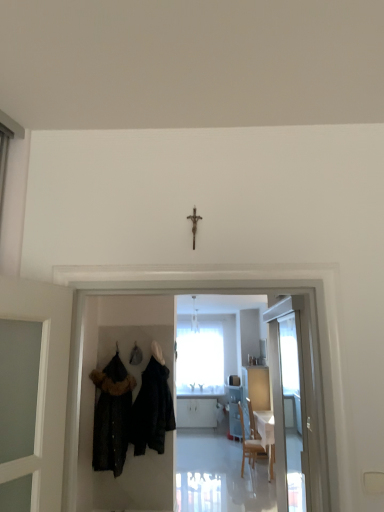
The width and height of the screenshot is (384, 512). I want to click on metallic crucifix at center, so click(x=194, y=223).

How much space does velvet black coat at left, which is counted as the 1th fancy dress, starting from the left, occupy horizontally?

The width of velvet black coat at left, which is counted as the 1th fancy dress, starting from the left, is 12.02 inches.

Where is `white glossy door at right`? white glossy door at right is located at coordinates (290, 401).

Between metallic crucifix at center and velvet black coat at center, which is counted as the first fancy dress, starting from the right, which one appears on the right side from the viewer's perspective?

From the viewer's perspective, metallic crucifix at center appears more on the right side.

From a real-world perspective, is metallic crucifix at center on velvet black coat at center, which is counted as the second fancy dress, starting from the left?

Yes, from a real-world perspective, metallic crucifix at center is on top of velvet black coat at center, which is counted as the second fancy dress, starting from the left.

Considering the sizes of metallic crucifix at center and velvet black coat at center, which is counted as the first fancy dress, starting from the right, in the image, is metallic crucifix at center bigger or smaller than velvet black coat at center, which is counted as the first fancy dress, starting from the right,?

In the image, metallic crucifix at center appears to be smaller than velvet black coat at center, which is counted as the first fancy dress, starting from the right.

Does point (193, 217) lie in front of point (146, 410)?

That is True.

Looking at this image, from a real-world perspective, is white glossy door at right physically below velvet black coat at center, which is counted as the first fancy dress, starting from the right?

No, from a real-world perspective, white glossy door at right is not beneath velvet black coat at center, which is counted as the first fancy dress, starting from the right.

Choose the correct answer: Is white glossy door at right inside velvet black coat at center, which is counted as the first fancy dress, starting from the right, or outside it?

white glossy door at right is spatially situated outside velvet black coat at center, which is counted as the first fancy dress, starting from the right.

Looking at this image, who is smaller, white glossy door at right or velvet black coat at center, which is counted as the second fancy dress, starting from the left?

white glossy door at right is smaller.

Is white glossy door at right shorter than velvet black coat at center, which is counted as the second fancy dress, starting from the left?

No, white glossy door at right is not shorter than velvet black coat at center, which is counted as the second fancy dress, starting from the left.

Is velvet black coat at left, arranged as the second fancy dress when viewed from the right, located within metallic crucifix at center?

No, velvet black coat at left, arranged as the second fancy dress when viewed from the right, is not a part of metallic crucifix at center.

From the image's perspective, which one is positioned higher, metallic crucifix at center or velvet black coat at left, which is counted as the 1th fancy dress, starting from the left?

metallic crucifix at center.

Is metallic crucifix at center far from velvet black coat at left, which is counted as the 1th fancy dress, starting from the left?

Yes, metallic crucifix at center and velvet black coat at left, which is counted as the 1th fancy dress, starting from the left, are located far from each other.

From a real-world perspective, is metallic crucifix at center below velvet black coat at left, which is counted as the 1th fancy dress, starting from the left?

Incorrect, from a real-world perspective, metallic crucifix at center is higher than velvet black coat at left, which is counted as the 1th fancy dress, starting from the left.

Measure the distance from white glossy door at right to velvet black coat at left, arranged as the second fancy dress when viewed from the right.

white glossy door at right and velvet black coat at left, arranged as the second fancy dress when viewed from the right, are 1.40 meters apart from each other.

From the image's perspective, which one is positioned lower, white glossy door at right or velvet black coat at left, which is counted as the 1th fancy dress, starting from the left?

velvet black coat at left, which is counted as the 1th fancy dress, starting from the left, is shown below in the image.

Considering the points (298, 425) and (109, 383), which point is in front, point (298, 425) or point (109, 383)?

The point (109, 383) is closer to the camera.

From a real-world perspective, is white glossy door at right above or below velvet black coat at left, which is counted as the 1th fancy dress, starting from the left?

Clearly, from a real-world perspective, white glossy door at right is above velvet black coat at left, which is counted as the 1th fancy dress, starting from the left.

Can you tell me how much velvet black coat at center, which is counted as the first fancy dress, starting from the right, and metallic crucifix at center differ in facing direction?

The facing directions of velvet black coat at center, which is counted as the first fancy dress, starting from the right, and metallic crucifix at center are 1.34 degrees apart.

Is velvet black coat at center, which is counted as the first fancy dress, starting from the right, not near metallic crucifix at center?

velvet black coat at center, which is counted as the first fancy dress, starting from the right, is far away from metallic crucifix at center.

Considering the relative sizes of velvet black coat at center, which is counted as the first fancy dress, starting from the right, and metallic crucifix at center in the image provided, is velvet black coat at center, which is counted as the first fancy dress, starting from the right, thinner than metallic crucifix at center?

No.

From the image's perspective, which one is positioned higher, white glossy door at right or metallic crucifix at center?

From the image's view, metallic crucifix at center is above.

Which is more to the right, white glossy door at right or metallic crucifix at center?

white glossy door at right.

Is the surface of white glossy door at right in direct contact with metallic crucifix at center?

No, white glossy door at right is not making contact with metallic crucifix at center.

Which object is wider, velvet black coat at center, which is counted as the first fancy dress, starting from the right, or velvet black coat at left, arranged as the second fancy dress when viewed from the right?

With larger width is velvet black coat at center, which is counted as the first fancy dress, starting from the right.

Does point (163, 433) lie behind point (98, 377)?

No, it is not.

Considering their positions, is velvet black coat at center, which is counted as the second fancy dress, starting from the left, located in front of or behind velvet black coat at left, which is counted as the 1th fancy dress, starting from the left?

velvet black coat at center, which is counted as the second fancy dress, starting from the left, is behind velvet black coat at left, which is counted as the 1th fancy dress, starting from the left.

From the image's perspective, is velvet black coat at center, which is counted as the second fancy dress, starting from the left, positioned above or below velvet black coat at left, which is counted as the 1th fancy dress, starting from the left?

Clearly, from the image's perspective, velvet black coat at center, which is counted as the second fancy dress, starting from the left, is above velvet black coat at left, which is counted as the 1th fancy dress, starting from the left.

In order to click on crucifix that is above the velvet black coat at center, which is counted as the first fancy dress, starting from the right (from a real-world perspective) in this screenshot , I will do coord(194,223).

Starting from the white glossy door at right, which fancy dress is the 1st one to the left? Please provide its 2D coordinates.

[(152, 410)]

Based on their spatial positions, is metallic crucifix at center or velvet black coat at left, arranged as the second fancy dress when viewed from the right, further from white glossy door at right?

The object further to white glossy door at right is metallic crucifix at center.

Which object lies further to the anchor point metallic crucifix at center, white glossy door at right or velvet black coat at center, which is counted as the first fancy dress, starting from the right?

The object further to metallic crucifix at center is white glossy door at right.

Based on the photo, which object lies further to the anchor point metallic crucifix at center, velvet black coat at center, which is counted as the first fancy dress, starting from the right, or velvet black coat at left, arranged as the second fancy dress when viewed from the right?

velvet black coat at left, arranged as the second fancy dress when viewed from the right.

Which object lies nearer to the anchor point velvet black coat at center, which is counted as the first fancy dress, starting from the right, metallic crucifix at center or white glossy door at right?

white glossy door at right is positioned closer to the anchor velvet black coat at center, which is counted as the first fancy dress, starting from the right.

Considering their positions, is velvet black coat at left, arranged as the second fancy dress when viewed from the right, positioned further to metallic crucifix at center than velvet black coat at center, which is counted as the first fancy dress, starting from the right?

A: velvet black coat at left, arranged as the second fancy dress when viewed from the right, is further to metallic crucifix at center.

Looking at this image, looking at the image, which one is located closer to velvet black coat at center, which is counted as the first fancy dress, starting from the right, velvet black coat at left, arranged as the second fancy dress when viewed from the right, or metallic crucifix at center?

Based on the image, velvet black coat at left, arranged as the second fancy dress when viewed from the right, appears to be nearer to velvet black coat at center, which is counted as the first fancy dress, starting from the right.

From the image, which object appears to be farther from velvet black coat at left, which is counted as the 1th fancy dress, starting from the left, velvet black coat at center, which is counted as the first fancy dress, starting from the right, or metallic crucifix at center?

metallic crucifix at center lies further to velvet black coat at left, which is counted as the 1th fancy dress, starting from the left, than the other object.

Considering their positions, is velvet black coat at center, which is counted as the first fancy dress, starting from the right, positioned further to white glossy door at right than velvet black coat at left, arranged as the second fancy dress when viewed from the right?

velvet black coat at left, arranged as the second fancy dress when viewed from the right.

Locate an element on the screen. The height and width of the screenshot is (512, 384). door between metallic crucifix at center and velvet black coat at center, which is counted as the first fancy dress, starting from the right, from front to back is located at coordinates (290, 401).

Locate an element on the screen. fancy dress between metallic crucifix at center and velvet black coat at center, which is counted as the second fancy dress, starting from the left, in the front-back direction is located at coordinates (112, 416).

Find the location of a particular element. fancy dress between white glossy door at right and velvet black coat at center, which is counted as the second fancy dress, starting from the left, along the z-axis is located at coordinates (112, 416).

In order to click on door positioned between metallic crucifix at center and velvet black coat at left, which is counted as the 1th fancy dress, starting from the left, from near to far in this screenshot , I will do `click(290, 401)`.